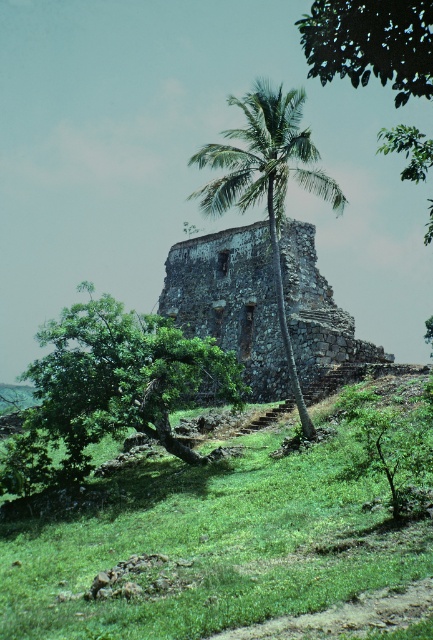
Question: Which point is farther from the camera taking this photo?

Choices:
 (A) (317, 301)
 (B) (25, 488)
 (C) (303, 173)
 (D) (429, 77)

Answer: (A)

Question: Where is green grassy at center located in relation to green leafy palm at upper center in the image?

Choices:
 (A) below
 (B) above

Answer: (A)

Question: Which object is closer to the camera taking this photo?

Choices:
 (A) rusty stone ruins at center
 (B) green leafy tree at center
 (C) green leafy palm at center

Answer: (C)

Question: Among these points, which one is farthest from the camera?

Choices:
 (A) click(293, 112)
 (B) click(394, 29)
 (C) click(174, 266)
 (D) click(145, 532)

Answer: (C)

Question: Is green grassy at center below green leafy palm at upper center?

Choices:
 (A) no
 (B) yes

Answer: (B)

Question: From the image, what is the correct spatial relationship of green grassy at center in relation to green leafy tree at center?

Choices:
 (A) below
 (B) above

Answer: (A)